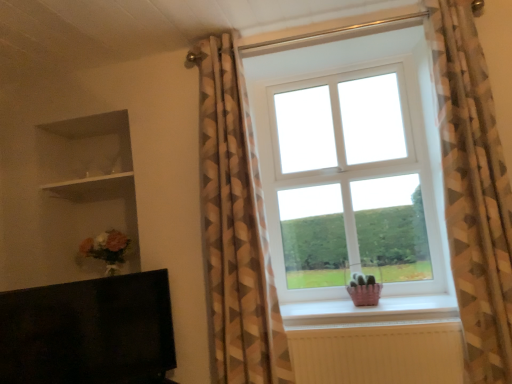
Question: Does white glossy shelf at upper left have a larger size compared to geometric-patterned curtain at right, which is the second curtain from left to right?

Choices:
 (A) yes
 (B) no

Answer: (B)

Question: Does white glossy shelf at upper left come behind geometric-patterned curtain at right, the first curtain positioned from the right?

Choices:
 (A) yes
 (B) no

Answer: (A)

Question: Would you say white glossy shelf at upper left is outside geometric-patterned curtain at right, the first curtain positioned from the right?

Choices:
 (A) yes
 (B) no

Answer: (A)

Question: From a real-world perspective, is white glossy shelf at upper left physically below geometric-patterned curtain at right, which is the second curtain from left to right?

Choices:
 (A) no
 (B) yes

Answer: (A)

Question: Is white glossy shelf at upper left facing towards geometric-patterned curtain at right, the first curtain positioned from the right?

Choices:
 (A) no
 (B) yes

Answer: (A)

Question: Considering the relative sizes of white glossy shelf at upper left and geometric-patterned curtain at right, the first curtain positioned from the right, in the image provided, is white glossy shelf at upper left shorter than geometric-patterned curtain at right, the first curtain positioned from the right,?

Choices:
 (A) yes
 (B) no

Answer: (A)

Question: Considering the relative positions of geometric-patterned curtain at center, which ranks as the first curtain in left-to-right order, and geometric-patterned curtain at right, the first curtain positioned from the right, in the image provided, is geometric-patterned curtain at center, which ranks as the first curtain in left-to-right order, to the left of geometric-patterned curtain at right, the first curtain positioned from the right, from the viewer's perspective?

Choices:
 (A) yes
 (B) no

Answer: (A)

Question: Does geometric-patterned curtain at center, which ranks as the first curtain in left-to-right order, come behind geometric-patterned curtain at right, the first curtain positioned from the right?

Choices:
 (A) yes
 (B) no

Answer: (A)

Question: Is geometric-patterned curtain at center, which ranks as the first curtain in left-to-right order, not within geometric-patterned curtain at right, which is the second curtain from left to right?

Choices:
 (A) no
 (B) yes

Answer: (B)

Question: Is geometric-patterned curtain at center, which ranks as the first curtain in left-to-right order, bigger than geometric-patterned curtain at right, which is the second curtain from left to right?

Choices:
 (A) yes
 (B) no

Answer: (A)

Question: Does geometric-patterned curtain at center, which appears as the 2th curtain when viewed from the right, have a smaller size compared to geometric-patterned curtain at right, the first curtain positioned from the right?

Choices:
 (A) yes
 (B) no

Answer: (B)

Question: Is geometric-patterned curtain at center, which appears as the 2th curtain when viewed from the right, next to geometric-patterned curtain at right, which is the second curtain from left to right?

Choices:
 (A) yes
 (B) no

Answer: (B)

Question: From the image's perspective, is geometric-patterned curtain at center, which ranks as the first curtain in left-to-right order, beneath matte pink basket at lower center?

Choices:
 (A) yes
 (B) no

Answer: (B)